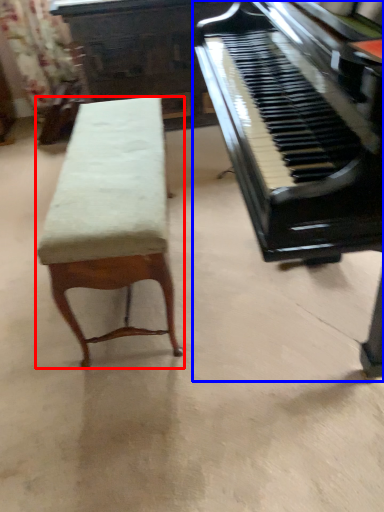
Question: Which object appears farthest to the camera in this image, furniture (highlighted by a red box) or piano (highlighted by a blue box)?

Choices:
 (A) furniture
 (B) piano

Answer: (A)